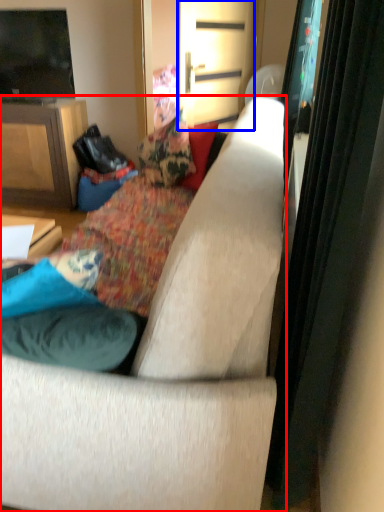
Question: Which object appears closest to the camera in this image, studio couch (highlighted by a red box) or screen door (highlighted by a blue box)?

Choices:
 (A) studio couch
 (B) screen door

Answer: (A)